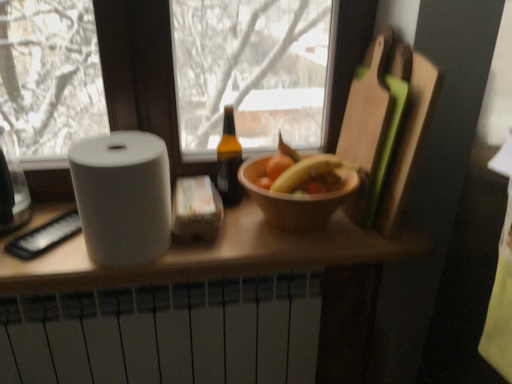
Describe the element at coordinates (229, 162) in the screenshot. I see `brown glass bottle at center` at that location.

This screenshot has width=512, height=384. Find the location of `clear glass jar at left`. clear glass jar at left is located at coordinates (12, 186).

The height and width of the screenshot is (384, 512). What do you see at coordinates (302, 172) in the screenshot?
I see `smooth wooden bowl at center` at bounding box center [302, 172].

This screenshot has height=384, width=512. Find the location of `wooden cutting board at right`. wooden cutting board at right is located at coordinates (386, 129).

Describe the element at coordinates (295, 198) in the screenshot. I see `wooden bowl at center` at that location.

Identify the location of wooden bowl at center. The height and width of the screenshot is (384, 512). (295, 198).

Identify the location of brown glass bottle at center. (229, 162).

Does point (257, 187) appear closer or farther from the camera than point (24, 177)?

Point (257, 187) is closer to the camera than point (24, 177).

Is wooden bowl at center positioned in front of clear glass jar at left?

No, the depth of wooden bowl at center is greater than that of clear glass jar at left.

How many degrees apart are the facing directions of wooden bowl at center and clear glass jar at left?

wooden bowl at center and clear glass jar at left are facing 0.349 degrees away from each other.

Consider the image. Considering the sizes of objects wooden bowl at center and clear glass jar at left in the image provided, who is taller, wooden bowl at center or clear glass jar at left?

With more height is clear glass jar at left.

Which is behind, point (238, 195) or point (259, 166)?

The point (238, 195) is behind.

In order to click on bowl below the brown glass bottle at center (from the image's perspective) in this screenshot , I will do `click(295, 198)`.

From the image's perspective, does brown glass bottle at center appear lower than wooden bowl at center?

No, from the image's perspective, brown glass bottle at center is not beneath wooden bowl at center.

Is brown glass bottle at center not near wooden bowl at center?

Actually, brown glass bottle at center and wooden bowl at center are a little close together.

Considering the positions of point (11, 228) and point (232, 151), is point (11, 228) closer or farther from the camera than point (232, 151)?

Point (11, 228) is positioned closer to the camera compared to point (232, 151).

Is clear glass jar at left positioned with its back to brown glass bottle at center?

No.

Which of these two, clear glass jar at left or brown glass bottle at center, is wider?

clear glass jar at left is wider.

Would you consider clear glass jar at left to be distant from brown glass bottle at center?

Actually, clear glass jar at left and brown glass bottle at center are a little close together.

Would you say clear glass jar at left is inside or outside white matte paper towel at left?

clear glass jar at left is not inside white matte paper towel at left, it's outside.

From the image's perspective, relative to white matte paper towel at left, is clear glass jar at left above or below?

clear glass jar at left is above white matte paper towel at left.

Between point (26, 221) and point (140, 154), which one is positioned behind?

The point (26, 221) is more distant.

From a real-world perspective, is clear glass jar at left on white matte paper towel at left?

Yes.

Considering the positions of objects brown glass bottle at center and wooden cutting board at right in the image provided, who is in front, brown glass bottle at center or wooden cutting board at right?

wooden cutting board at right.

Is brown glass bottle at center aimed at wooden cutting board at right?

No, brown glass bottle at center is not facing towards wooden cutting board at right.

Visually, is brown glass bottle at center positioned to the left or to the right of wooden cutting board at right?

From the image, it's evident that brown glass bottle at center is to the left of wooden cutting board at right.

Is point (12, 154) closer or farther from the camera than point (253, 169)?

Point (12, 154).

Which object is wider, clear glass jar at left or wooden bowl at center?

wooden bowl at center.

Are clear glass jar at left and wooden bowl at center located far from each other?

clear glass jar at left is actually quite close to wooden bowl at center.

Which of these two, clear glass jar at left or wooden bowl at center, stands shorter?

wooden bowl at center is shorter.

From a real-world perspective, is clear glass jar at left over wooden cutting board at right?

Incorrect, from a real-world perspective, clear glass jar at left is lower than wooden cutting board at right.

Choose the correct answer: Is clear glass jar at left inside wooden cutting board at right or outside it?

The correct answer is: outside.

Is clear glass jar at left positioned behind wooden cutting board at right?

That is True.

There is a wooden bowl at center. Where is `kitchen appliance above it (from a real-world perspective)`? The width and height of the screenshot is (512, 384). kitchen appliance above it (from a real-world perspective) is located at coordinates (12, 186).

This screenshot has width=512, height=384. What are the coordinates of `bowl lying below the brown glass bottle at center (from the image's perspective)` in the screenshot? It's located at (295, 198).

Estimate the real-world distances between objects in this image. Which object is further from smooth wooden bowl at center, wooden bowl at center or white matte radiator at lower center?

white matte radiator at lower center.

When comparing their distances from brown glass bottle at center, does wooden cutting board at right or white matte paper towel at left seem closer?

white matte paper towel at left.

Looking at the image, which one is located further to white matte radiator at lower center, wooden cutting board at right or white matte paper towel at left?

Among the two, wooden cutting board at right is located further to white matte radiator at lower center.

From the image, which object appears to be farther from clear glass jar at left, white matte paper towel at left or smooth wooden bowl at center?

The object further to clear glass jar at left is smooth wooden bowl at center.

Estimate the real-world distances between objects in this image. Which object is further from wooden cutting board at right, clear glass jar at left or white matte radiator at lower center?

clear glass jar at left is further to wooden cutting board at right.

From the image, which object appears to be farther from smooth wooden bowl at center, white matte paper towel at left or brown glass bottle at center?

The object further to smooth wooden bowl at center is white matte paper towel at left.

Based on their spatial positions, is white matte radiator at lower center or brown glass bottle at center closer to smooth wooden bowl at center?

brown glass bottle at center lies closer to smooth wooden bowl at center than the other object.

Based on the photo, based on their spatial positions, is wooden bowl at center or wooden cutting board at right closer to brown glass bottle at center?

wooden bowl at center lies closer to brown glass bottle at center than the other object.

This screenshot has height=384, width=512. I want to click on bottle situated between white matte paper towel at left and wooden bowl at center from left to right, so click(229, 162).

The width and height of the screenshot is (512, 384). I want to click on bottle between clear glass jar at left and wooden bowl at center from left to right, so click(x=229, y=162).

I want to click on bottle that lies between smooth wooden bowl at center and white matte radiator at lower center from top to bottom, so click(229, 162).

Locate an element on the screen. Image resolution: width=512 pixels, height=384 pixels. paper towel between clear glass jar at left and white matte radiator at lower center vertically is located at coordinates (123, 197).